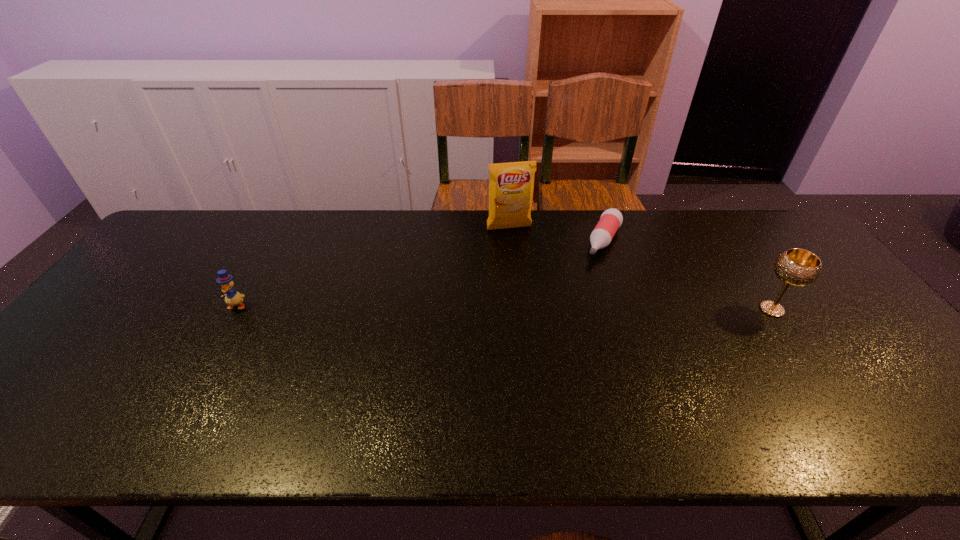
Where is `vacant space on the desktop that is between the duckling and the third shortest object and is positioned on the front of the second object from left to right with the logo`? The height and width of the screenshot is (540, 960). vacant space on the desktop that is between the duckling and the third shortest object and is positioned on the front of the second object from left to right with the logo is located at coordinates [538, 308].

Identify the location of free spot on the desktop that is between the second shortest object and the third shortest object and is positioned with the cap open on the bottle. The width and height of the screenshot is (960, 540). (565, 308).